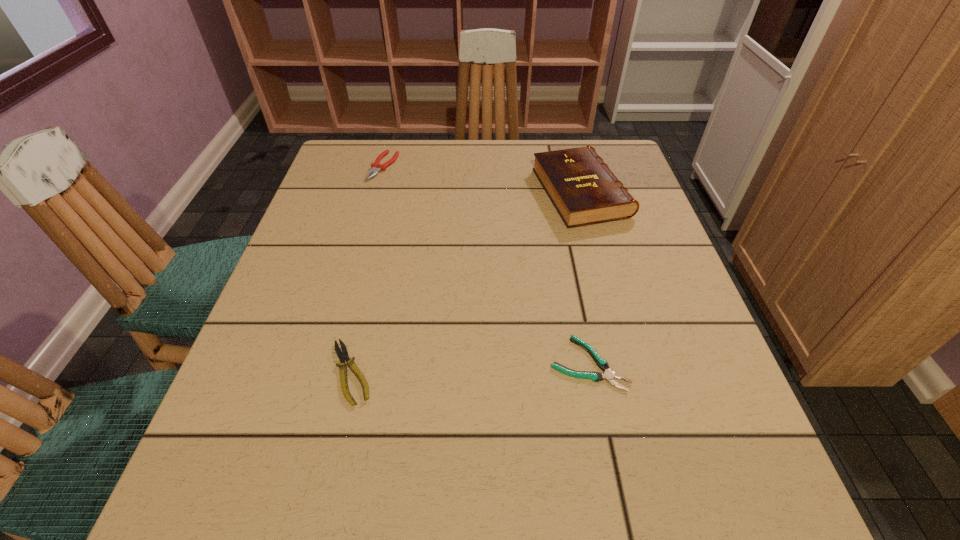
Where is `hardback book situated at the far edge`? hardback book situated at the far edge is located at coordinates (583, 189).

Locate an element on the screen. Image resolution: width=960 pixels, height=540 pixels. pliers positioned at the far edge is located at coordinates (375, 166).

Where is `hardback book that is at the right edge`? hardback book that is at the right edge is located at coordinates (583, 189).

In order to click on pliers positioned at the right edge in this screenshot , I will do `click(609, 375)`.

You are a GUI agent. You are given a task and a screenshot of the screen. Output one action in this format:
    pyautogui.click(x=<x>, y=<y>)
    Task: Click on the object that is at the far left corner
    
    Given the screenshot: What is the action you would take?
    pyautogui.click(x=375, y=166)

Identify the location of object that is at the far right corner. The image size is (960, 540). (583, 189).

This screenshot has width=960, height=540. In order to click on free space at the far edge of the desktop in this screenshot , I will do `click(522, 161)`.

Find the location of `vacant space at the near edge of the desktop`. vacant space at the near edge of the desktop is located at coordinates (505, 467).

Find the location of a particular element. Image resolution: width=960 pixels, height=540 pixels. blank space at the left edge is located at coordinates (351, 209).

Where is `vacant space at the right edge of the desktop`? vacant space at the right edge of the desktop is located at coordinates (629, 390).